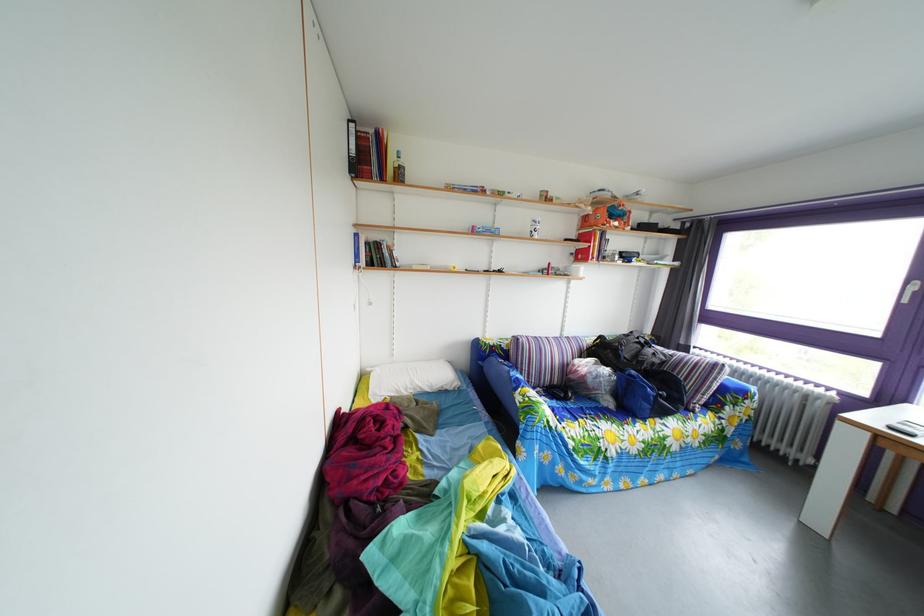
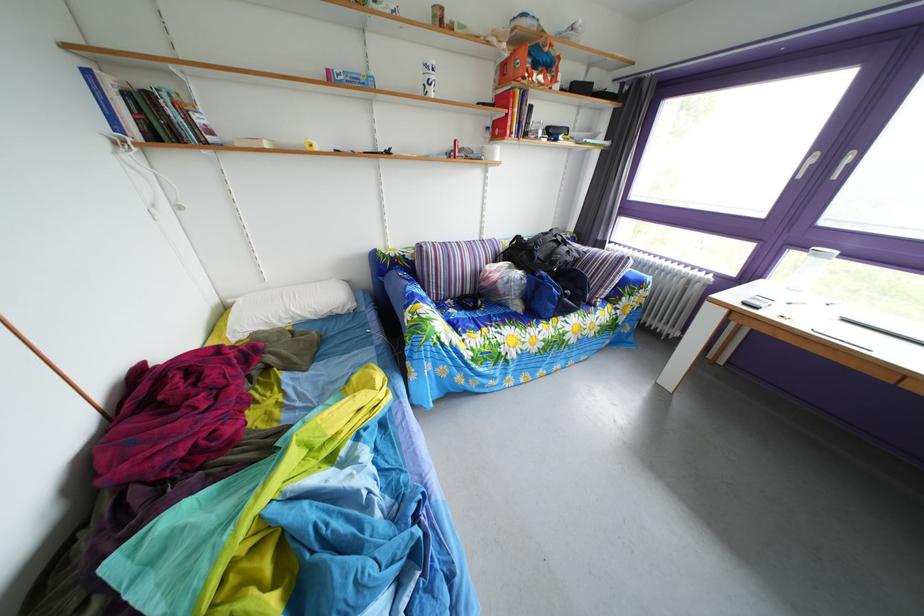
Locate, in the second image, the point that corresponds to [643,379] in the first image.

(553, 282)